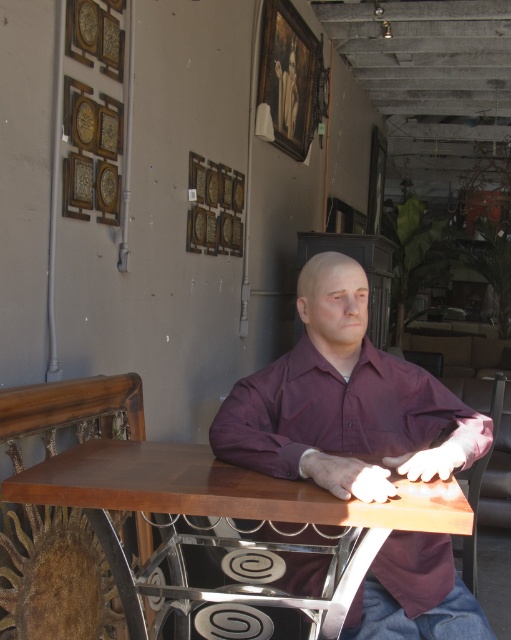
You are an interior designer assessing the layout of this space. You need to ensure that all items on the wooden table at center are visible from above. Considering the height of the matte purple shirt at center, will it obstruct the view of the table?

The matte purple shirt at center is taller than the wooden table at center, so it will obstruct the view of the table from above.

You are a customer in this shop and you see the matte purple shirt at center and the wooden textured chair at left. Which object is positioned more to the left side of the image?

The wooden textured chair at left is positioned more to the left side of the image than the matte purple shirt at center.